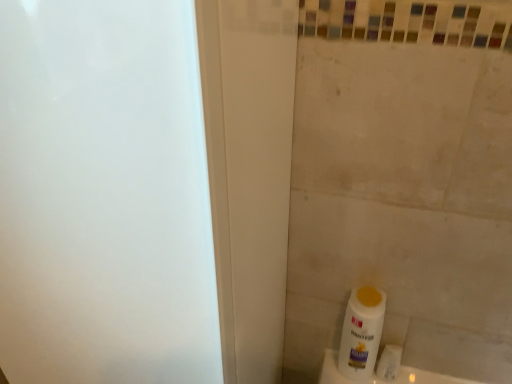
Question: Could you tell me if white plastic bottle at lower right is turned towards white matte toilet paper at lower right?

Choices:
 (A) no
 (B) yes

Answer: (A)

Question: Can you confirm if white plastic bottle at lower right is bigger than white matte toilet paper at lower right?

Choices:
 (A) yes
 (B) no

Answer: (A)

Question: Is white plastic bottle at lower right to the left of white matte toilet paper at lower right from the viewer's perspective?

Choices:
 (A) no
 (B) yes

Answer: (B)

Question: Is white matte toilet paper at lower right located within white plastic bottle at lower right?

Choices:
 (A) no
 (B) yes

Answer: (A)

Question: Does white plastic bottle at lower right have a smaller size compared to white matte toilet paper at lower right?

Choices:
 (A) no
 (B) yes

Answer: (A)

Question: From a real-world perspective, is white plastic bottle at lower right positioned over white matte toilet paper at lower right based on gravity?

Choices:
 (A) yes
 (B) no

Answer: (A)

Question: Is white matte toilet paper at lower right taller than white plastic bottle at lower right?

Choices:
 (A) yes
 (B) no

Answer: (B)

Question: Does white matte toilet paper at lower right appear on the left side of white plastic bottle at lower right?

Choices:
 (A) yes
 (B) no

Answer: (B)

Question: Is white plastic bottle at lower right surrounded by white matte toilet paper at lower right?

Choices:
 (A) yes
 (B) no

Answer: (B)

Question: Does white matte toilet paper at lower right lie in front of white plastic bottle at lower right?

Choices:
 (A) yes
 (B) no

Answer: (B)

Question: From a real-world perspective, is white matte toilet paper at lower right physically below white plastic bottle at lower right?

Choices:
 (A) yes
 (B) no

Answer: (A)

Question: From the image's perspective, is white matte toilet paper at lower right under white plastic bottle at lower right?

Choices:
 (A) no
 (B) yes

Answer: (B)

Question: Does point (389, 360) appear closer or farther from the camera than point (343, 342)?

Choices:
 (A) closer
 (B) farther

Answer: (B)